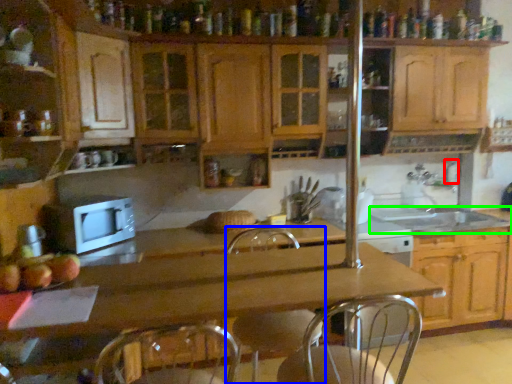
Question: Considering the real-world distances, which object is farthest from faucet (highlighted by a red box)? swivel chair (highlighted by a blue box) or sink (highlighted by a green box)?

Choices:
 (A) swivel chair
 (B) sink

Answer: (A)